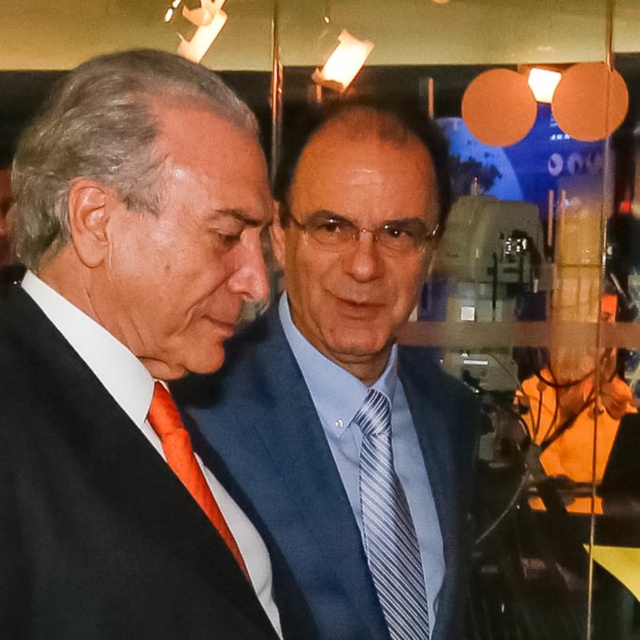
Question: Estimate the real-world distances between objects in this image. Which object is closer to the blue striped tie at center?

Choices:
 (A) orange silk tie at left
 (B) matte black suit at left

Answer: (A)

Question: Based on their relative distances, which object is farther from the orange silk tie at left?

Choices:
 (A) blue striped tie at center
 (B) blue satin suit at center
 (C) matte black suit at left

Answer: (A)

Question: Does matte black suit at left appear under blue striped tie at center?

Choices:
 (A) yes
 (B) no

Answer: (B)

Question: Which point appears closest to the camera in this image?

Choices:
 (A) (x=186, y=481)
 (B) (x=56, y=445)
 (C) (x=404, y=529)
 (D) (x=404, y=241)

Answer: (B)

Question: Does matte black suit at left appear on the left side of orange silk tie at left?

Choices:
 (A) yes
 (B) no

Answer: (A)

Question: Does matte black suit at left come behind blue striped tie at center?

Choices:
 (A) no
 (B) yes

Answer: (A)